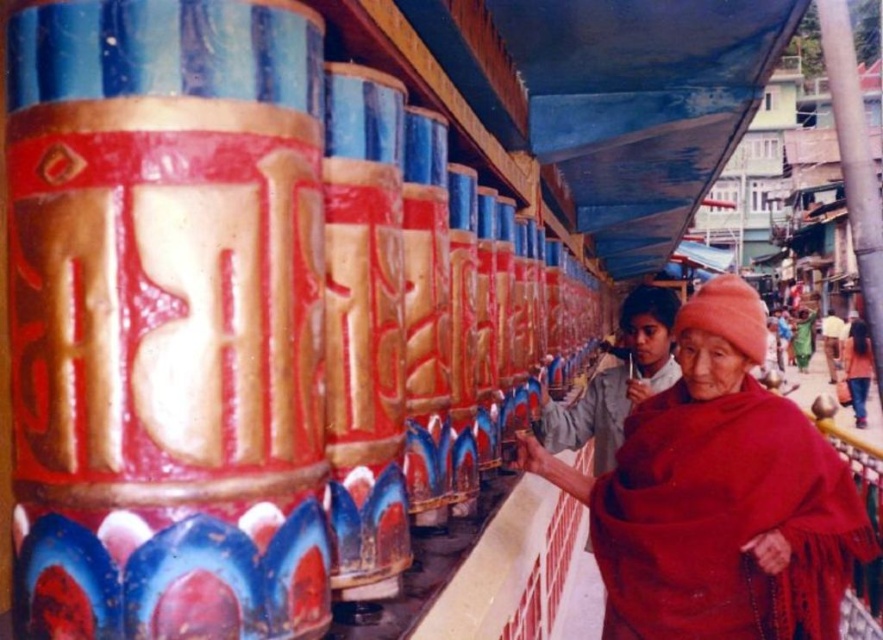
Between orange fabric at lower right and light brown leather jacket at lower right, which one appears on the left side from the viewer's perspective?

Positioned to the left is orange fabric at lower right.

Which is more to the right, orange fabric at lower right or light brown leather jacket at lower right?

From the viewer's perspective, light brown leather jacket at lower right appears more on the right side.

Measure the distance between point [851,333] and camera.

27.10 meters

Locate an element on the screen. The width and height of the screenshot is (883, 640). orange fabric at lower right is located at coordinates (857, 368).

Can you confirm if red woolen robe at lower right is bigger than red woolen robe at right?

Yes.

Does red woolen robe at lower right appear under red woolen robe at right?

Yes, red woolen robe at lower right is below red woolen robe at right.

Who is more distant from viewer, (651, 445) or (597, 470)?

The point (597, 470) is behind.

Locate an element on the screen. The height and width of the screenshot is (640, 883). red woolen robe at lower right is located at coordinates (723, 520).

Does red woolen robe at right have a greater width compared to orange fabric at lower right?

Incorrect, red woolen robe at right's width does not surpass orange fabric at lower right's.

From the picture: Who is lower down, red woolen robe at right or orange fabric at lower right?

orange fabric at lower right

Is point (624, 417) farther from camera compared to point (859, 385)?

No, it is not.

Image resolution: width=883 pixels, height=640 pixels. I want to click on red woolen robe at right, so click(x=589, y=417).